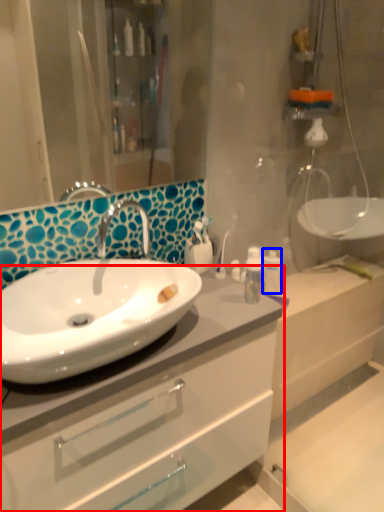
Question: Which object is further to the camera taking this photo, bathroom cabinet (highlighted by a red box) or toiletry (highlighted by a blue box)?

Choices:
 (A) bathroom cabinet
 (B) toiletry

Answer: (B)